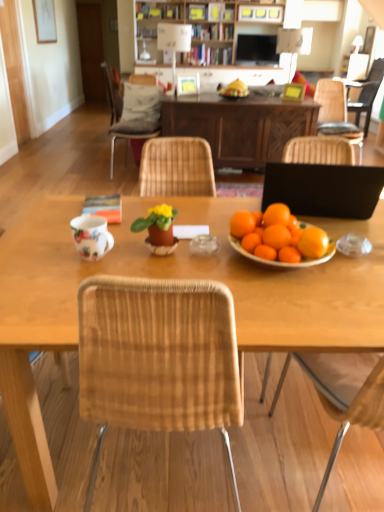
Image resolution: width=384 pixels, height=512 pixels. Identify the location of free location in front of floral ceramic mug at center. (72, 279).